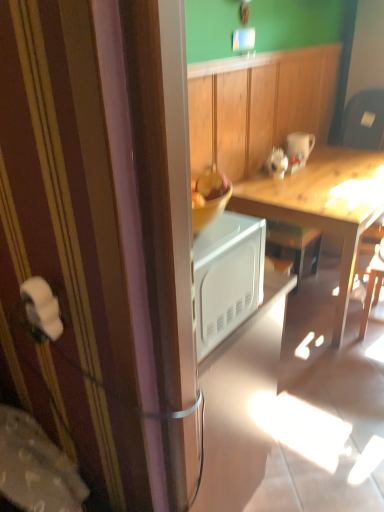
Question: Relative to white glossy mug at upper right, is wooden desk at center in front or behind?

Choices:
 (A) behind
 (B) front

Answer: (B)

Question: Based on their positions, is wooden desk at center located to the left or right of white glossy mug at upper right?

Choices:
 (A) right
 (B) left

Answer: (A)

Question: From their relative heights in the image, would you say wooden desk at center is taller or shorter than white glossy mug at upper right?

Choices:
 (A) short
 (B) tall

Answer: (B)

Question: Looking at their shapes, would you say white glossy mug at upper right is wider or thinner than wooden desk at center?

Choices:
 (A) wide
 (B) thin

Answer: (B)

Question: Does point (299, 141) appear closer or farther from the camera than point (337, 316)?

Choices:
 (A) farther
 (B) closer

Answer: (A)

Question: From the image's perspective, relative to wooden desk at center, is white glossy mug at upper right above or below?

Choices:
 (A) above
 (B) below

Answer: (A)

Question: Based on their sizes in the image, would you say white glossy mug at upper right is bigger or smaller than wooden desk at center?

Choices:
 (A) big
 (B) small

Answer: (B)